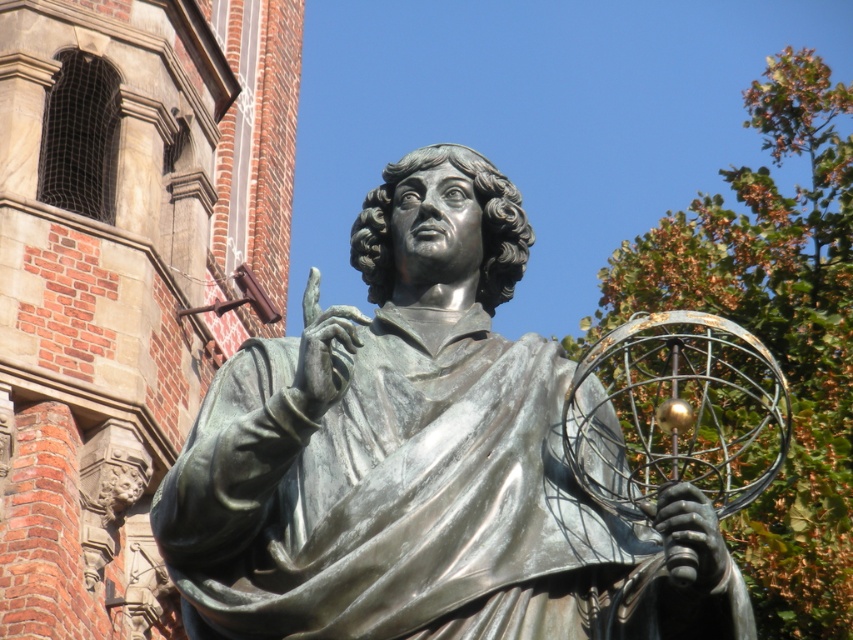
You are standing in front of the bronze statue at center and the brick wall at center. Which object is closer to your right side?

The bronze statue at center is to the right of brick wall at center, so the bronze statue at center is closer to your right side.

You are standing in front of a building with a statue. The statue is located at point (421,458). Can you tell me where the bronze statue is positioned relative to the building?

The bronze statue at center is positioned at point (421,458) relative to the building.

You are a painter who wants to capture the statue in a painting. Since the bronze statue at center and the brick wall at center are in the same scene, which one is closer to you?

The bronze statue at center is closer to you because it is in front of the brick wall at center.